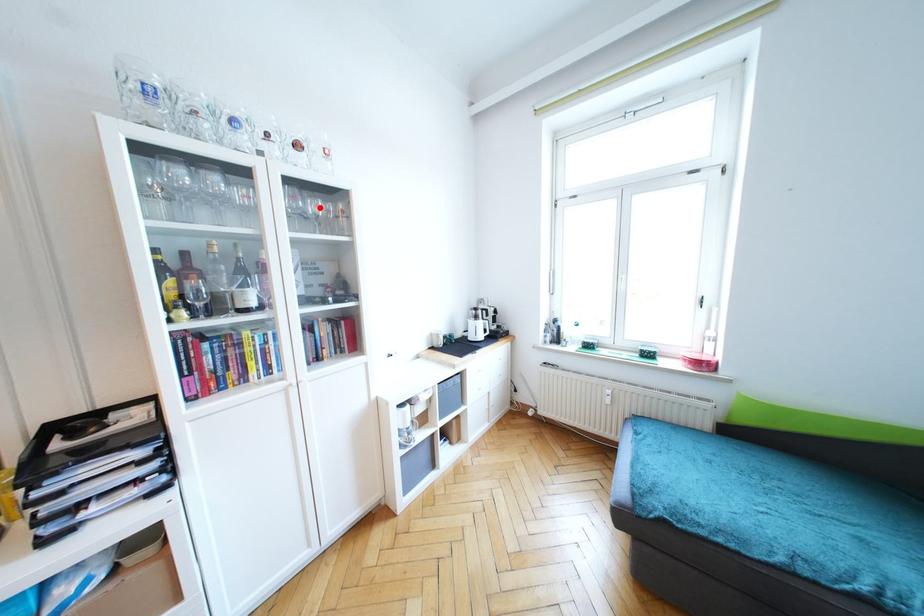
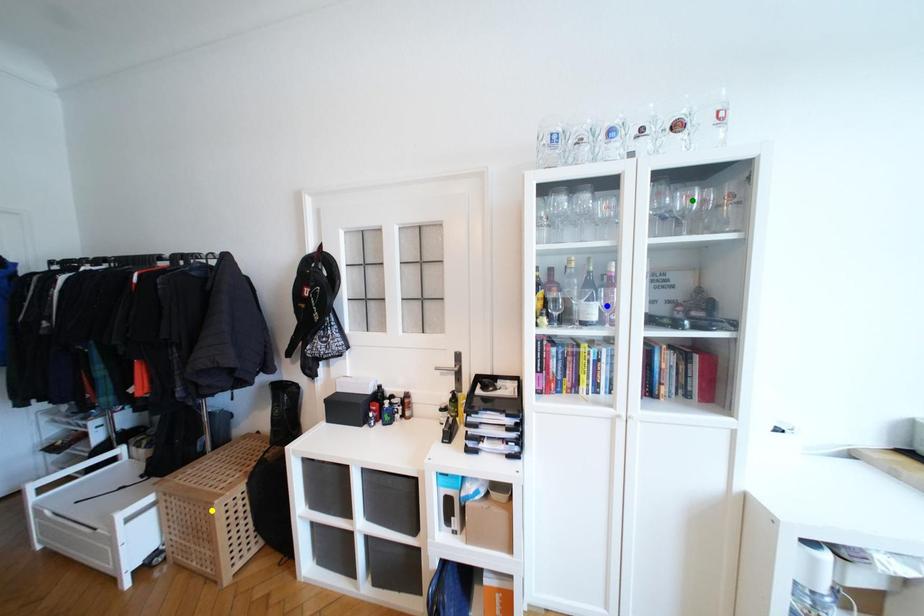
Question: I am providing you with two images of the same scene from different viewpoints. A red point is marked on the first image. You are given multiple points on the second image. Which mark in image 2 goes with the point in image 1?

Choices:
 (A) yellow point
 (B) green point
 (C) blue point

Answer: (B)